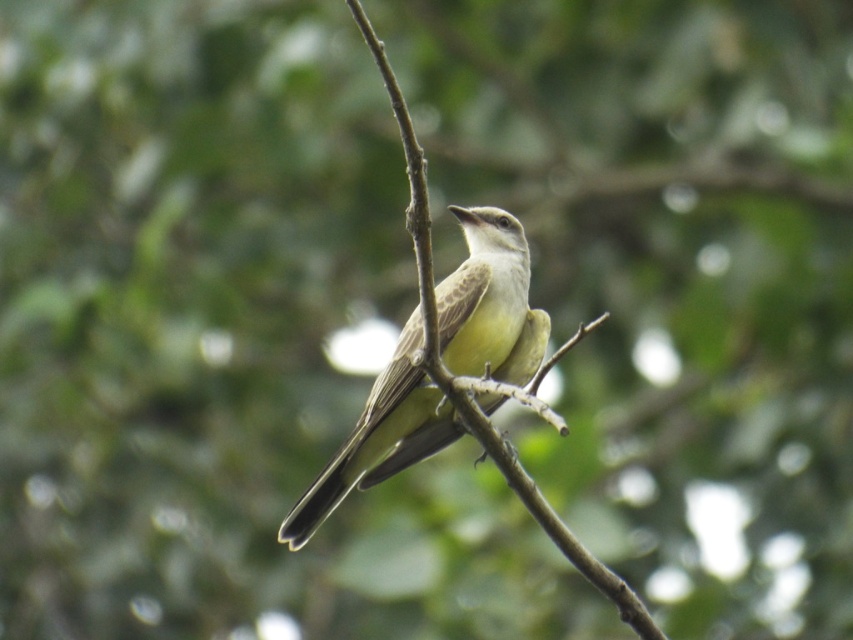
Can you confirm if light brown feathers at center is positioned below brown wood tree branch at center?

Incorrect, light brown feathers at center is not positioned below brown wood tree branch at center.

The image size is (853, 640). Find the location of `light brown feathers at center`. light brown feathers at center is located at coordinates (490, 301).

Is point (410, 349) less distant than point (434, 356)?

No, (410, 349) is further to viewer.

You are a GUI agent. You are given a task and a screenshot of the screen. Output one action in this format:
    pyautogui.click(x=<x>, y=<y>)
    Task: Click on the light brown feathers at center
    The width and height of the screenshot is (853, 640).
    Given the screenshot: What is the action you would take?
    pyautogui.click(x=490, y=301)